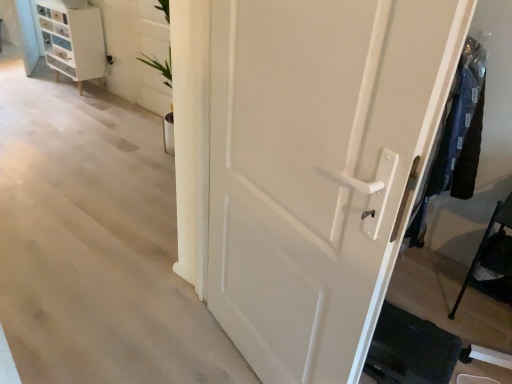
Question: Is black metal cane at lower right wider than white matte door at center?

Choices:
 (A) no
 (B) yes

Answer: (B)

Question: Is black metal cane at lower right to the right of white matte door at center from the viewer's perspective?

Choices:
 (A) yes
 (B) no

Answer: (A)

Question: From the image's perspective, is black metal cane at lower right beneath white matte door at center?

Choices:
 (A) yes
 (B) no

Answer: (A)

Question: Is black metal cane at lower right outside white matte door at center?

Choices:
 (A) no
 (B) yes

Answer: (B)

Question: Is black metal cane at lower right surrounding white matte door at center?

Choices:
 (A) no
 (B) yes

Answer: (A)

Question: Is black metal cane at lower right far away from white matte door at center?

Choices:
 (A) no
 (B) yes

Answer: (B)

Question: Is white glossy chest of drawers at upper left to the left of dark blue fabric at right from the viewer's perspective?

Choices:
 (A) no
 (B) yes

Answer: (B)

Question: Is white glossy chest of drawers at upper left at the right side of dark blue fabric at right?

Choices:
 (A) no
 (B) yes

Answer: (A)

Question: Can we say white glossy chest of drawers at upper left lies outside dark blue fabric at right?

Choices:
 (A) no
 (B) yes

Answer: (B)

Question: Can you confirm if white glossy chest of drawers at upper left is smaller than dark blue fabric at right?

Choices:
 (A) yes
 (B) no

Answer: (B)

Question: Does white glossy chest of drawers at upper left contain dark blue fabric at right?

Choices:
 (A) no
 (B) yes

Answer: (A)

Question: Is white glossy chest of drawers at upper left with dark blue fabric at right?

Choices:
 (A) no
 (B) yes

Answer: (A)

Question: Can you confirm if white matte door at center is smaller than white glossy chest of drawers at upper left?

Choices:
 (A) no
 (B) yes

Answer: (A)